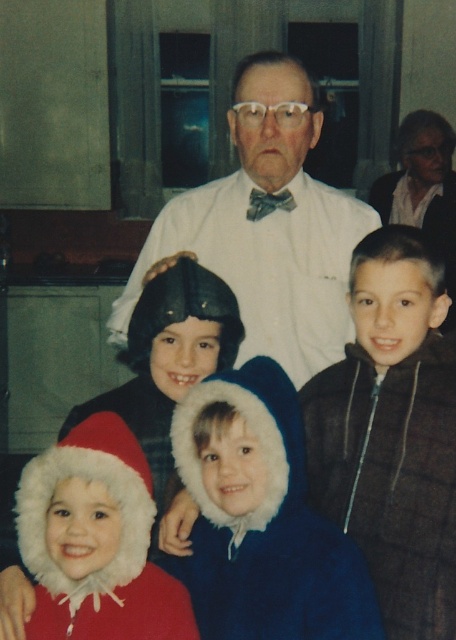
Question: Is white textured shirt at center bigger than fuzzy red santa hat at lower left?

Choices:
 (A) yes
 (B) no

Answer: (A)

Question: Which point is farther to the camera?

Choices:
 (A) (267, 458)
 (B) (398, 392)
 (C) (279, 164)
 (D) (62, 589)

Answer: (C)

Question: Which point is farther from the camera taking this photo?

Choices:
 (A) (393, 604)
 (B) (103, 422)
 (C) (269, 600)

Answer: (A)

Question: Is brown plaid jacket at right smaller than fuzzy blue coat at center?

Choices:
 (A) yes
 (B) no

Answer: (B)

Question: Among these objects, which one is farthest from the camera?

Choices:
 (A) fuzzy red santa hat at lower left
 (B) fuzzy blue coat at center

Answer: (A)

Question: From the image, what is the correct spatial relationship of brown plaid jacket at right in relation to white textured shirt at center?

Choices:
 (A) right
 (B) left

Answer: (A)